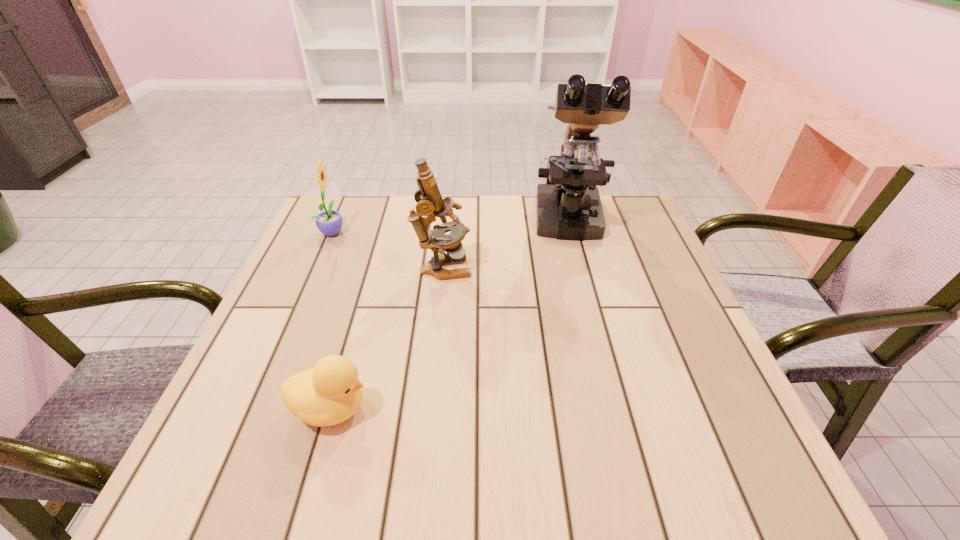
Where is `object that is positioned at the far right corner`? The width and height of the screenshot is (960, 540). object that is positioned at the far right corner is located at coordinates (568, 207).

You are a GUI agent. You are given a task and a screenshot of the screen. Output one action in this format:
    pyautogui.click(x=<x>, y=<y>)
    Task: Click on the vacant space at the far edge of the desktop
    The width and height of the screenshot is (960, 540).
    Given the screenshot: What is the action you would take?
    pyautogui.click(x=378, y=240)

Find the location of `vacant space at the left edge of the desktop`. vacant space at the left edge of the desktop is located at coordinates (293, 336).

Identify the location of free region at the right edge of the desktop. (662, 271).

Find the location of `free space at the far right corner of the desktop`. free space at the far right corner of the desktop is located at coordinates (604, 206).

Image resolution: width=960 pixels, height=540 pixels. In the image, there is a desktop. In order to click on free space at the near right corner in this screenshot , I will do `click(720, 460)`.

Find the location of a particular element. free space between the third object from left to right and the tallest object is located at coordinates (506, 246).

The height and width of the screenshot is (540, 960). In order to click on vacant space in between the second nearest object and the nearest object in this screenshot , I will do `click(387, 339)`.

This screenshot has width=960, height=540. What are the coordinates of `vacant area that lies between the tallest object and the second tallest object` in the screenshot? It's located at (506, 246).

At what (x,y) coordinates should I click in order to perform the action: click on empty space between the farther microscope and the left microscope. Please return your answer as a coordinate pair (x, y). The width and height of the screenshot is (960, 540). Looking at the image, I should click on (506, 246).